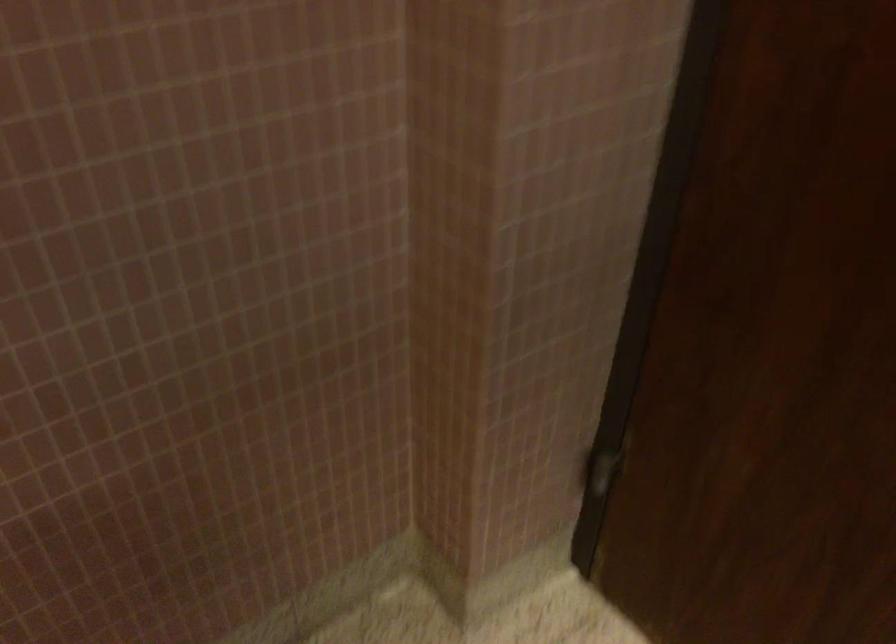
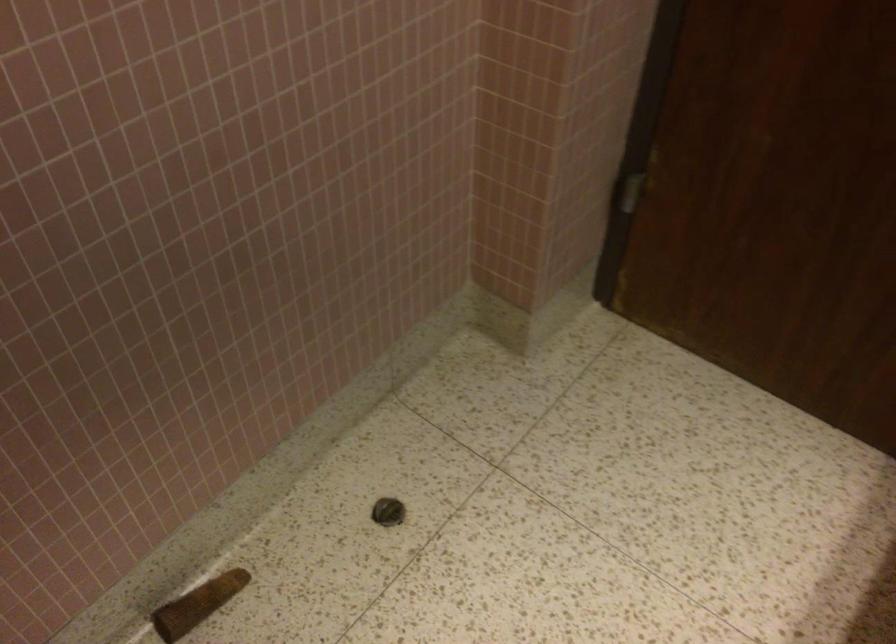
Question: The camera is either moving clockwise (left) or counter-clockwise (right) around the object. The first image is from the beginning of the video and the second image is from the end. Is the camera moving left or right when shooting the video?

Choices:
 (A) Left
 (B) Right

Answer: (A)